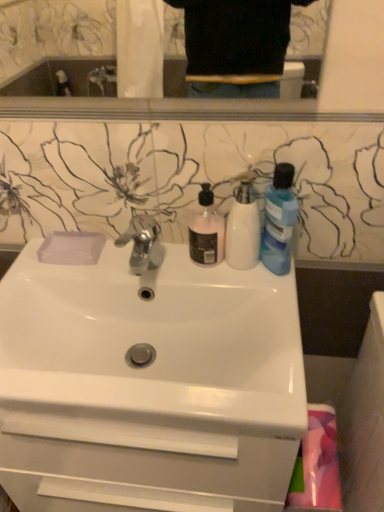
Measure the distance between point (63, 256) and camera.

Point (63, 256) is 36.50 inches from camera.

Describe the element at coordinates (316, 465) in the screenshot. The height and width of the screenshot is (512, 384). I see `pink fabric at lower right` at that location.

What do you see at coordinates (279, 220) in the screenshot? The image size is (384, 512). I see `blue translucent bottle at upper right, which is counted as the 3th cleaning product, starting from the left` at bounding box center [279, 220].

The image size is (384, 512). I want to click on blue translucent bottle at upper right, which is counted as the first cleaning product, starting from the right, so click(x=279, y=220).

The height and width of the screenshot is (512, 384). In order to click on pink matte liquid soap at center, the 1th cleaning product positioned from the left in this screenshot , I will do `click(206, 230)`.

The image size is (384, 512). Find the location of `transparent plastic soap at upper left`. transparent plastic soap at upper left is located at coordinates (71, 248).

Which is in front, point (301, 490) or point (253, 255)?

The point (301, 490) is in front.

Considering the positions of objects pink fabric at lower right and white matte bottle at center, marked as the 2th cleaning product in a left-to-right arrangement, in the image provided, who is more to the left, pink fabric at lower right or white matte bottle at center, marked as the 2th cleaning product in a left-to-right arrangement,?

white matte bottle at center, marked as the 2th cleaning product in a left-to-right arrangement.

Which is behind, pink fabric at lower right or white matte bottle at center, marked as the 2th cleaning product in a left-to-right arrangement?

white matte bottle at center, marked as the 2th cleaning product in a left-to-right arrangement, is behind.

Which is behind, point (140, 241) or point (319, 455)?

The point (140, 241) is farther from the camera.

Is polished chrome faucet at center beside pink fabric at lower right?

No, polished chrome faucet at center is not beside pink fabric at lower right.

From the image's perspective, which one is positioned higher, polished chrome faucet at center or pink fabric at lower right?

From the image's view, polished chrome faucet at center is above.

In terms of size, does polished chrome faucet at center appear bigger or smaller than pink fabric at lower right?

Considering their sizes, polished chrome faucet at center takes up less space than pink fabric at lower right.

Can you confirm if white glossy sink at center is taller than pink matte liquid soap at center, which is the 3th cleaning product from right to left?

Yes.

Which is more to the right, white glossy sink at center or pink matte liquid soap at center, the 1th cleaning product positioned from the left?

pink matte liquid soap at center, the 1th cleaning product positioned from the left, is more to the right.

From a real-world perspective, is white glossy sink at center on pink matte liquid soap at center, which is the 3th cleaning product from right to left?

Incorrect, from a real-world perspective, white glossy sink at center is lower than pink matte liquid soap at center, which is the 3th cleaning product from right to left.

You are a GUI agent. You are given a task and a screenshot of the screen. Output one action in this format:
    pyautogui.click(x=<x>, y=<y>)
    Task: Click on the 1st cleaning product above the white glossy sink at center (from a real-world perspective)
    Image resolution: width=384 pixels, height=512 pixels.
    Given the screenshot: What is the action you would take?
    pyautogui.click(x=206, y=230)

Is pink matte liquid soap at center, the 1th cleaning product positioned from the left, inside the boundaries of white glossy sink at center, or outside?

pink matte liquid soap at center, the 1th cleaning product positioned from the left, lies outside white glossy sink at center.

The width and height of the screenshot is (384, 512). What are the coordinates of `sink directly beneath the pink matte liquid soap at center, which is the 3th cleaning product from right to left (from a real-world perspective)` in the screenshot? It's located at (154, 341).

Is pink matte liquid soap at center, which is the 3th cleaning product from right to left, oriented away from white glossy sink at center?

No, pink matte liquid soap at center, which is the 3th cleaning product from right to left, is not facing away from white glossy sink at center.

Is pink matte liquid soap at center, which is the 3th cleaning product from right to left, far from white glossy sink at center?

No, pink matte liquid soap at center, which is the 3th cleaning product from right to left, is not far from white glossy sink at center.

Relative to white matte bottle at center, marked as the 2th cleaning product in a left-to-right arrangement, is pink matte liquid soap at center, which is the 3th cleaning product from right to left, in front or behind?

pink matte liquid soap at center, which is the 3th cleaning product from right to left, is positioned farther from the viewer than white matte bottle at center, marked as the 2th cleaning product in a left-to-right arrangement.

Is pink matte liquid soap at center, which is the 3th cleaning product from right to left, oriented away from white matte bottle at center, marked as the second cleaning product in a right-to-left arrangement?

pink matte liquid soap at center, which is the 3th cleaning product from right to left, is not turned away from white matte bottle at center, marked as the second cleaning product in a right-to-left arrangement.

In the image, is pink matte liquid soap at center, which is the 3th cleaning product from right to left, on the left side or the right side of white matte bottle at center, marked as the second cleaning product in a right-to-left arrangement?

pink matte liquid soap at center, which is the 3th cleaning product from right to left, is positioned on white matte bottle at center, marked as the second cleaning product in a right-to-left arrangement,'s left side.

Considering the sizes of objects pink matte liquid soap at center, the 1th cleaning product positioned from the left, and white matte bottle at center, marked as the second cleaning product in a right-to-left arrangement, in the image provided, who is smaller, pink matte liquid soap at center, the 1th cleaning product positioned from the left, or white matte bottle at center, marked as the second cleaning product in a right-to-left arrangement,?

With smaller size is pink matte liquid soap at center, the 1th cleaning product positioned from the left.

Is polished chrome faucet at center surrounding blue translucent bottle at upper right, which is counted as the first cleaning product, starting from the right?

No, blue translucent bottle at upper right, which is counted as the first cleaning product, starting from the right, is not surrounded by polished chrome faucet at center.

From the image's perspective, who appears lower, polished chrome faucet at center or blue translucent bottle at upper right, which is counted as the first cleaning product, starting from the right?

polished chrome faucet at center is shown below in the image.

Is polished chrome faucet at center positioned in front of blue translucent bottle at upper right, which is counted as the first cleaning product, starting from the right?

No, polished chrome faucet at center is further to the viewer.

Based on the photo, from a real-world perspective, relative to blue translucent bottle at upper right, which is counted as the 3th cleaning product, starting from the left, is polished chrome faucet at center vertically above or below?

polished chrome faucet at center is situated lower than blue translucent bottle at upper right, which is counted as the 3th cleaning product, starting from the left, in the real world.

Looking at this image, is pink matte liquid soap at center, which is the 3th cleaning product from right to left, further to the viewer compared to pink fabric at lower right?

Yes, pink matte liquid soap at center, which is the 3th cleaning product from right to left, is further from the camera.

Considering the sizes of objects pink matte liquid soap at center, which is the 3th cleaning product from right to left, and pink fabric at lower right in the image provided, who is thinner, pink matte liquid soap at center, which is the 3th cleaning product from right to left, or pink fabric at lower right?

With smaller width is pink matte liquid soap at center, which is the 3th cleaning product from right to left.

Is pink fabric at lower right at the back of pink matte liquid soap at center, which is the 3th cleaning product from right to left?

That's not correct — pink matte liquid soap at center, which is the 3th cleaning product from right to left, is not looking away from pink fabric at lower right.

From the image's perspective, which one is positioned higher, pink matte liquid soap at center, which is the 3th cleaning product from right to left, or pink fabric at lower right?

pink matte liquid soap at center, which is the 3th cleaning product from right to left.

Locate an element on the screen. The image size is (384, 512). the 1st cleaning product behind the pink fabric at lower right, starting your count from the anchor is located at coordinates (243, 226).

Where is `material below the polished chrome faucet at center (from a real-world perspective)`? material below the polished chrome faucet at center (from a real-world perspective) is located at coordinates (316, 465).

When comparing their distances from white glossy sink at center, does transparent plastic soap at upper left or blue translucent bottle at upper right, which is counted as the 3th cleaning product, starting from the left, seem closer?

The object closer to white glossy sink at center is transparent plastic soap at upper left.

Based on their spatial positions, is blue translucent bottle at upper right, which is counted as the first cleaning product, starting from the right, or pink matte liquid soap at center, the 1th cleaning product positioned from the left, closer to pink fabric at lower right?

Among the two, blue translucent bottle at upper right, which is counted as the first cleaning product, starting from the right, is located nearer to pink fabric at lower right.

Considering their positions, is white matte bottle at center, marked as the 2th cleaning product in a left-to-right arrangement, positioned closer to pink matte liquid soap at center, which is the 3th cleaning product from right to left, than blue translucent bottle at upper right, which is counted as the first cleaning product, starting from the right?

Based on the image, white matte bottle at center, marked as the 2th cleaning product in a left-to-right arrangement, appears to be nearer to pink matte liquid soap at center, which is the 3th cleaning product from right to left.

Considering their positions, is white matte bottle at center, marked as the 2th cleaning product in a left-to-right arrangement, positioned closer to white glossy sink at center than blue translucent bottle at upper right, which is counted as the 3th cleaning product, starting from the left?

white matte bottle at center, marked as the 2th cleaning product in a left-to-right arrangement, is closer to white glossy sink at center.

Looking at the image, which one is located closer to pink fabric at lower right, white matte bottle at center, marked as the second cleaning product in a right-to-left arrangement, or blue translucent bottle at upper right, which is counted as the first cleaning product, starting from the right?

blue translucent bottle at upper right, which is counted as the first cleaning product, starting from the right, lies closer to pink fabric at lower right than the other object.

Estimate the real-world distances between objects in this image. Which object is closer to blue translucent bottle at upper right, which is counted as the 3th cleaning product, starting from the left, white glossy sink at center or white matte bottle at center, marked as the second cleaning product in a right-to-left arrangement?

Among the two, white matte bottle at center, marked as the second cleaning product in a right-to-left arrangement, is located nearer to blue translucent bottle at upper right, which is counted as the 3th cleaning product, starting from the left.

Looking at the image, which one is located further to transparent plastic soap at upper left, blue translucent bottle at upper right, which is counted as the first cleaning product, starting from the right, or pink fabric at lower right?

Based on the image, pink fabric at lower right appears to be further to transparent plastic soap at upper left.

Looking at the image, which one is located further to pink matte liquid soap at center, which is the 3th cleaning product from right to left, polished chrome faucet at center or transparent plastic soap at upper left?

transparent plastic soap at upper left is further to pink matte liquid soap at center, which is the 3th cleaning product from right to left.

Identify the location of sink that lies between pink matte liquid soap at center, the 1th cleaning product positioned from the left, and pink fabric at lower right from top to bottom. The width and height of the screenshot is (384, 512). (154, 341).

Identify the location of tap between transparent plastic soap at upper left and pink fabric at lower right in the up-down direction. Image resolution: width=384 pixels, height=512 pixels. (143, 243).

Where is `tap between pink matte liquid soap at center, which is the 3th cleaning product from right to left, and white glossy sink at center, in the vertical direction`? tap between pink matte liquid soap at center, which is the 3th cleaning product from right to left, and white glossy sink at center, in the vertical direction is located at coordinates (143, 243).

Where is `tap that lies between blue translucent bottle at upper right, which is counted as the first cleaning product, starting from the right, and pink fabric at lower right from top to bottom`? tap that lies between blue translucent bottle at upper right, which is counted as the first cleaning product, starting from the right, and pink fabric at lower right from top to bottom is located at coordinates (143, 243).